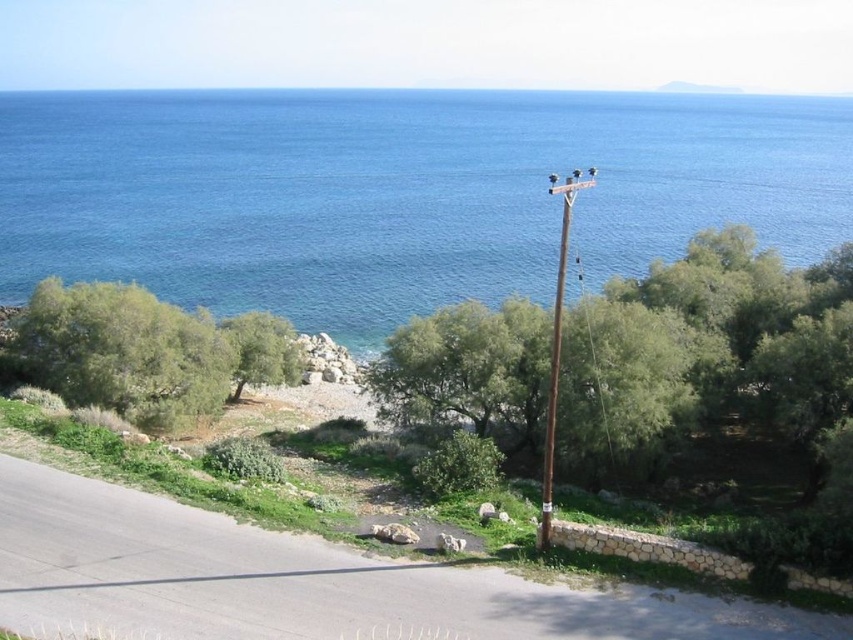
Question: Among these points, which one is farthest from the camera?

Choices:
 (A) (563, 209)
 (B) (469, 204)

Answer: (B)

Question: Which object is the farthest from the green leafy tree at left?

Choices:
 (A) green leafy tree at center
 (B) brown wooden telegraph pole at center-right
 (C) blue water at upper center

Answer: (C)

Question: Does blue water at upper center appear on the left side of green leafy tree at center?

Choices:
 (A) yes
 (B) no

Answer: (A)

Question: Which point appears farthest from the camera in this image?

Choices:
 (A) (207, 205)
 (B) (247, 328)
 (C) (560, 273)
 (D) (662, 436)

Answer: (A)

Question: Is green leafy tree at left further to camera compared to brown wooden telegraph pole at center-right?

Choices:
 (A) no
 (B) yes

Answer: (B)

Question: Can you confirm if blue water at upper center is smaller than green leafy tree at center?

Choices:
 (A) no
 (B) yes

Answer: (A)